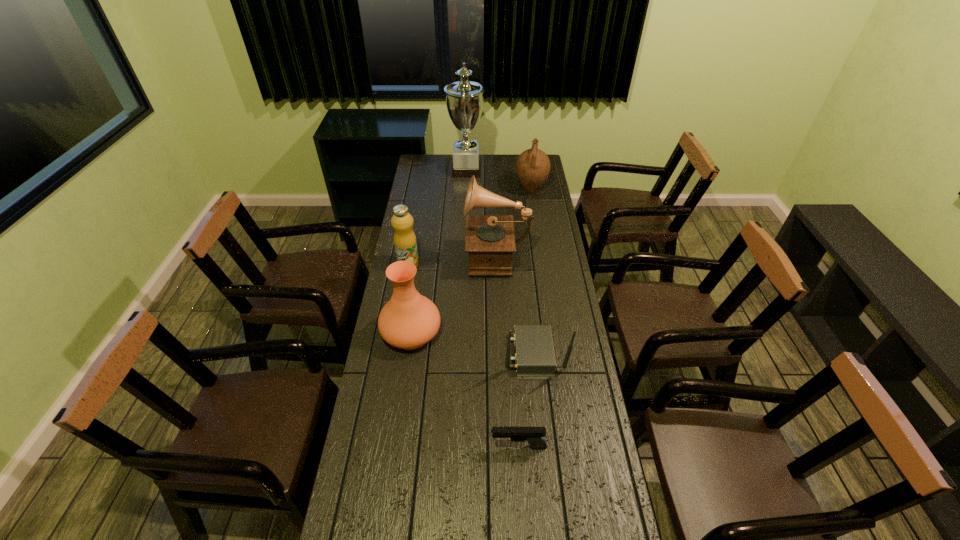
Identify the location of free spot at the far left corner of the desktop. (434, 163).

What are the coordinates of `free space between the router and the sixth shortest object` in the screenshot? It's located at (516, 303).

Identify the location of vacant space in between the fruit juice and the record player. (453, 259).

Image resolution: width=960 pixels, height=540 pixels. What are the coordinates of `unoccupied area between the trophy cup and the second tallest object` in the screenshot? It's located at (482, 212).

The height and width of the screenshot is (540, 960). I want to click on free spot between the fruit juice and the pistol, so click(x=464, y=355).

In order to click on the fifth closest object to the pitcher in this screenshot , I will do `click(534, 357)`.

Identify which object is the sixth closest to the record player. Please provide its 2D coordinates. Your answer should be formatted as a tuple, i.e. [(x, y)], where the tuple contains the x and y coordinates of a point satisfying the conditions above.

[(533, 435)]

I want to click on free region that satisfies the following two spatial constraints: 1. at the front view of the tallest object; 2. on the left side of the pitcher, so click(466, 190).

At what (x,y) coordinates should I click in order to perform the action: click on free space that satisfies the following two spatial constraints: 1. on the back side of the pitcher; 2. at the front view of the trophy cup. Please return your answer as a coordinate pair (x, y). Image resolution: width=960 pixels, height=540 pixels. Looking at the image, I should click on (528, 171).

Where is `free space that satisfies the following two spatial constraints: 1. at the front view of the trophy cup; 2. on the left side of the pitcher`? free space that satisfies the following two spatial constraints: 1. at the front view of the trophy cup; 2. on the left side of the pitcher is located at coordinates (466, 190).